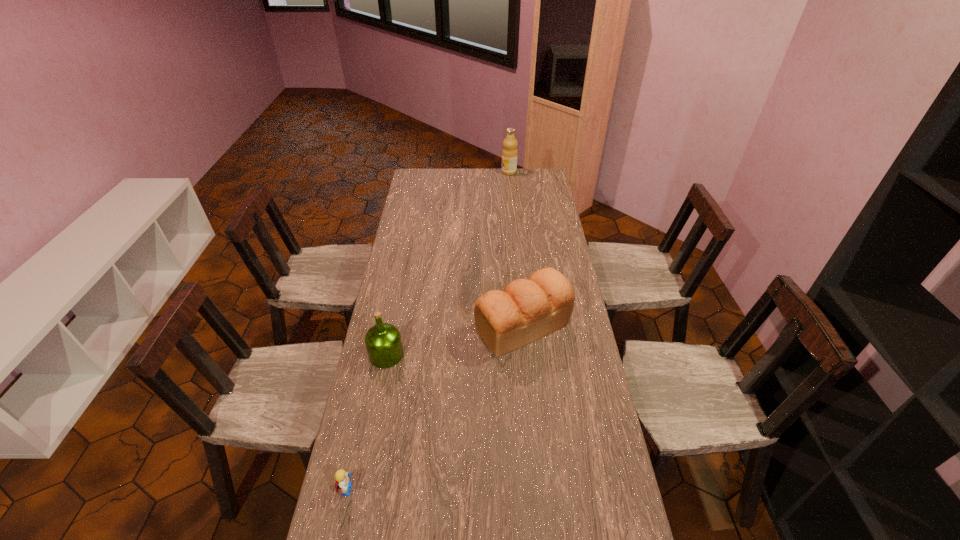
The image size is (960, 540). What are the coordinates of `vacant space in between the right olive oil and the left olive oil` in the screenshot? It's located at (447, 264).

Where is `unoccupied area between the shortest object and the bread`? unoccupied area between the shortest object and the bread is located at coordinates (436, 408).

Locate an element on the screen. The image size is (960, 540). vacant region between the Lego and the bread is located at coordinates (436, 408).

Locate an element on the screen. This screenshot has height=540, width=960. vacant space in between the nearest object and the bread is located at coordinates click(x=436, y=408).

This screenshot has height=540, width=960. I want to click on free space between the tallest object and the shorter olive oil, so click(447, 264).

Locate an element on the screen. This screenshot has width=960, height=540. vacant space in between the shortest object and the bread is located at coordinates point(436,408).

Image resolution: width=960 pixels, height=540 pixels. Identify the location of empty location between the tallest object and the bread. (516, 249).

Where is `vacant space in between the bread and the tallest object`? This screenshot has width=960, height=540. vacant space in between the bread and the tallest object is located at coordinates (516, 249).

This screenshot has width=960, height=540. What are the coordinates of `vacant region between the bread and the taller olive oil` in the screenshot? It's located at (516, 249).

Where is `free point between the bread and the left olive oil`? This screenshot has width=960, height=540. free point between the bread and the left olive oil is located at coordinates (454, 341).